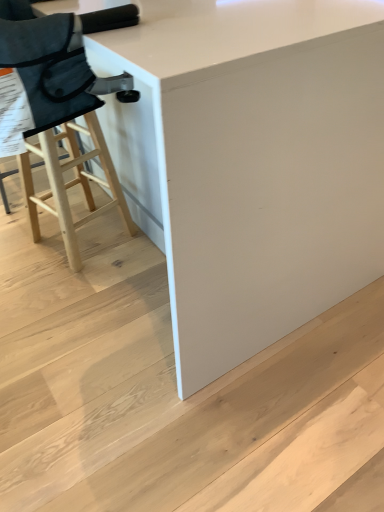
Question: Should I look upward or downward to see natural wood stool at left?

Choices:
 (A) down
 (B) up

Answer: (B)

Question: Is white glossy table at center inside natural wood stool at left?

Choices:
 (A) no
 (B) yes

Answer: (A)

Question: Is natural wood stool at left looking in the opposite direction of white glossy table at center?

Choices:
 (A) yes
 (B) no

Answer: (A)

Question: Does natural wood stool at left have a lesser height compared to white glossy table at center?

Choices:
 (A) yes
 (B) no

Answer: (A)

Question: Can we say natural wood stool at left lies outside white glossy table at center?

Choices:
 (A) yes
 (B) no

Answer: (B)

Question: Is natural wood stool at left at the left side of white glossy table at center?

Choices:
 (A) yes
 (B) no

Answer: (A)

Question: Does natural wood stool at left have a greater width compared to white glossy table at center?

Choices:
 (A) no
 (B) yes

Answer: (A)

Question: Considering the relative sizes of natural wood stool at left and white matte stair at lower center in the image provided, is natural wood stool at left wider than white matte stair at lower center?

Choices:
 (A) no
 (B) yes

Answer: (A)

Question: Is natural wood stool at left oriented towards white matte stair at lower center?

Choices:
 (A) yes
 (B) no

Answer: (B)

Question: From a real-world perspective, does natural wood stool at left stand above white matte stair at lower center?

Choices:
 (A) no
 (B) yes

Answer: (B)

Question: From the image's perspective, is natural wood stool at left on white matte stair at lower center?

Choices:
 (A) no
 (B) yes

Answer: (B)

Question: Is natural wood stool at left to the left of white matte stair at lower center from the viewer's perspective?

Choices:
 (A) no
 (B) yes

Answer: (B)

Question: Is natural wood stool at left positioned behind white matte stair at lower center?

Choices:
 (A) yes
 (B) no

Answer: (A)

Question: From the image's perspective, would you say white glossy table at center is shown under white matte stair at lower center?

Choices:
 (A) no
 (B) yes

Answer: (A)